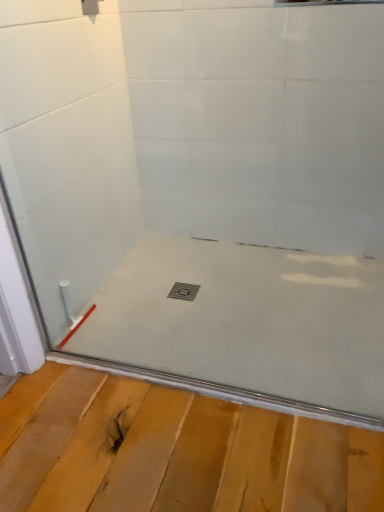
Where is `metallic square drain at center`? This screenshot has width=384, height=512. metallic square drain at center is located at coordinates (183, 291).

What do you see at coordinates (183, 291) in the screenshot?
I see `metallic square drain at center` at bounding box center [183, 291].

At what (x,y) coordinates should I click in order to perform the action: click on metallic square drain at center. Please return your answer as a coordinate pair (x, y). The image size is (384, 512). Looking at the image, I should click on (183, 291).